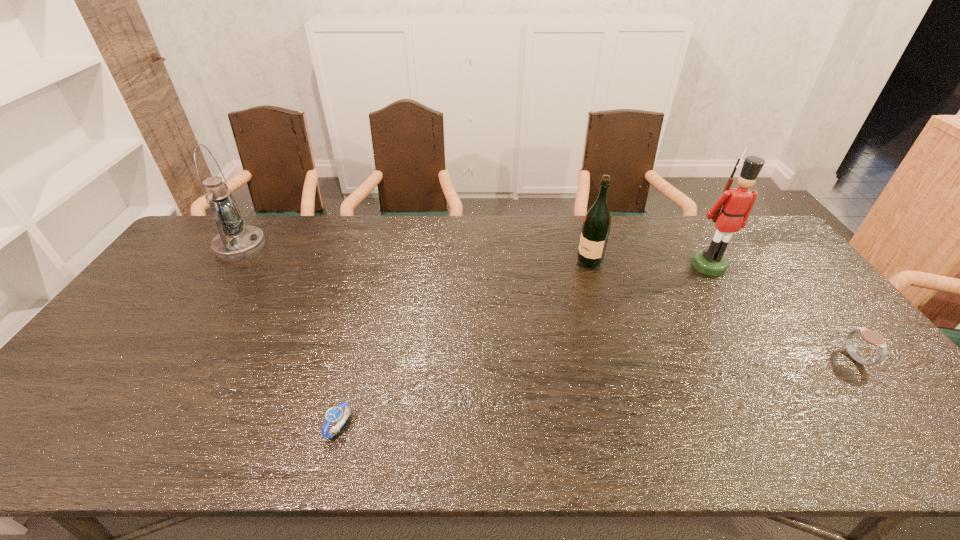
Where is `object that is at the right edge`? This screenshot has width=960, height=540. object that is at the right edge is located at coordinates (872, 337).

Find the location of a particular element. The width and height of the screenshot is (960, 540). object positioned at the far left corner is located at coordinates (236, 241).

This screenshot has width=960, height=540. Identify the location of vacant space at the far edge of the desktop. (706, 240).

I want to click on free region at the near edge, so click(367, 443).

You are a GUI agent. You are given a task and a screenshot of the screen. Output one action in this format:
    pyautogui.click(x=<x>, y=<y>)
    Task: Click on the free space at the left edge of the desktop
    
    Given the screenshot: What is the action you would take?
    pyautogui.click(x=151, y=349)

You are a GUI agent. You are given a task and a screenshot of the screen. Output one action in this format:
    pyautogui.click(x=<x>, y=<y>)
    Task: Click on the vacant area at the right edge
    The image size is (960, 540).
    Given the screenshot: What is the action you would take?
    pyautogui.click(x=846, y=375)

Identify the location of vacant space at the far right corner of the desktop. (768, 245).

Locate an element on the screen. vacant region between the shortest object and the farther watch is located at coordinates (597, 393).

Where is `vacant space in between the second object from left to right and the third object from left to right`? vacant space in between the second object from left to right and the third object from left to right is located at coordinates (465, 344).

You are a GUI agent. You are given a task and a screenshot of the screen. Output one action in this format:
    pyautogui.click(x=<x>, y=<y>)
    Task: Click on the free space between the right watch and the nutcracker
    
    Given the screenshot: What is the action you would take?
    pyautogui.click(x=782, y=312)